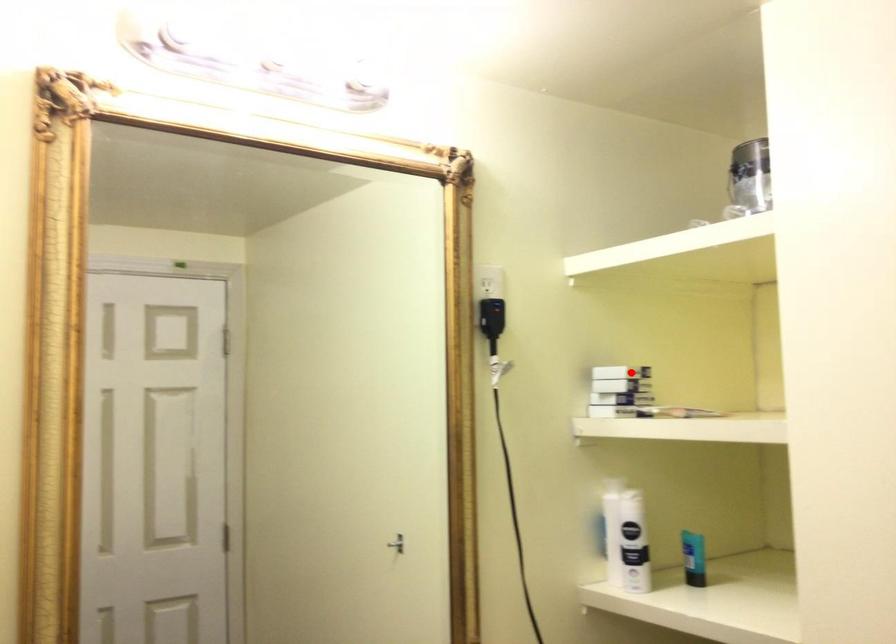
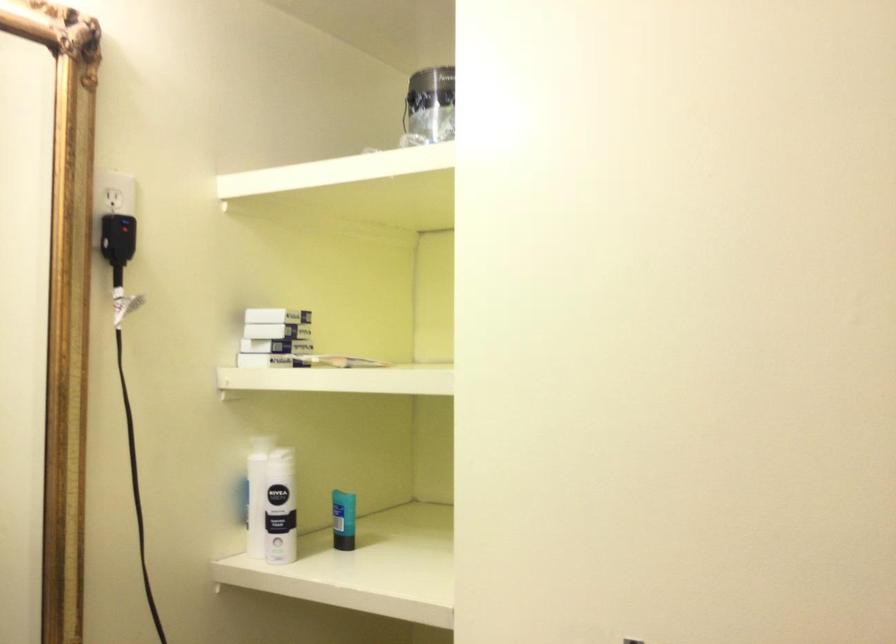
Locate, in the second image, the point that corresponds to the highlighted location in the first image.

(277, 315)